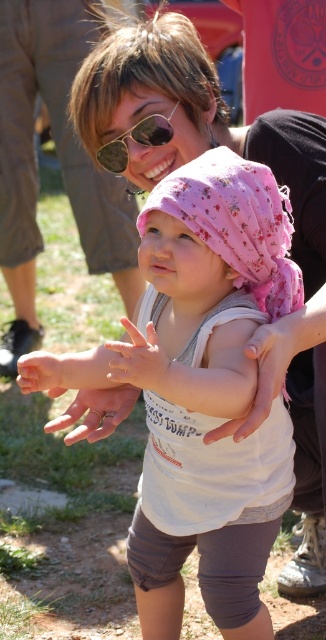
You are a photographer trying to capture the perfect shot of the adult and child. You notice the smooth skin hand at center and the sunglasses at center in your frame. Which object should you adjust to ensure they are both fully visible? Explain your reasoning.

The smooth skin hand at center has a lesser width compared to sunglasses at center. Since the hand is narrower, you should adjust the sunglasses at center, which is wider, to ensure both fit within the frame.

You are a photographer trying to capture the hands in the image. Which hand, the white matte hand at center or the smooth skin hand at center, would appear larger in your photo due to its position?

The white matte hand at center would appear larger in the photo because it is closer to the viewer than the smooth skin hand at center.